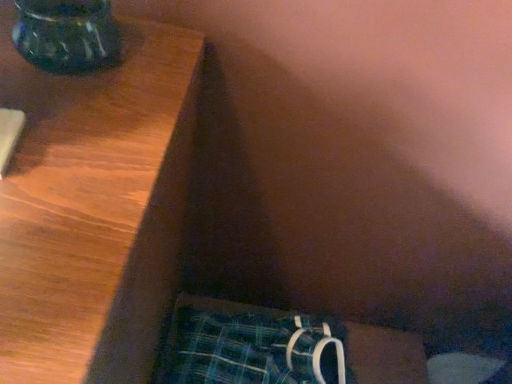
Based on the photo, what is the approximate height of plaid fabric underwear at lower right?

The height of plaid fabric underwear at lower right is 4.84 inches.

Locate an element on the screen. plaid fabric underwear at lower right is located at coordinates coord(251,349).

What do you see at coordinates (251, 349) in the screenshot? I see `plaid fabric underwear at lower right` at bounding box center [251, 349].

Locate an element on the screen. The height and width of the screenshot is (384, 512). translucent glass vase at upper left is located at coordinates (66, 34).

Measure the distance between point (x=82, y=70) and camera.

The depth of point (x=82, y=70) is 14.80 inches.

What do you see at coordinates (66, 34) in the screenshot?
I see `translucent glass vase at upper left` at bounding box center [66, 34].

Locate an element on the screen. Image resolution: width=512 pixels, height=384 pixels. plaid fabric underwear at lower right is located at coordinates (251, 349).

Consider the image. Between translucent glass vase at upper left and plaid fabric underwear at lower right, which one appears on the right side from the viewer's perspective?

Positioned to the right is plaid fabric underwear at lower right.

Which object is further away from the camera, translucent glass vase at upper left or plaid fabric underwear at lower right?

plaid fabric underwear at lower right is behind.

Considering the positions of points (119, 50) and (337, 338), is point (119, 50) farther from camera compared to point (337, 338)?

No.

From the image's perspective, between translucent glass vase at upper left and plaid fabric underwear at lower right, who is located below?

plaid fabric underwear at lower right, from the image's perspective.

From a real-world perspective, is translucent glass vase at upper left physically located above or below plaid fabric underwear at lower right?

translucent glass vase at upper left is above plaid fabric underwear at lower right.

Does translucent glass vase at upper left have a greater width compared to plaid fabric underwear at lower right?

In fact, translucent glass vase at upper left might be narrower than plaid fabric underwear at lower right.

Considering the sizes of objects translucent glass vase at upper left and plaid fabric underwear at lower right in the image provided, who is taller, translucent glass vase at upper left or plaid fabric underwear at lower right?

plaid fabric underwear at lower right.

Considering the relative sizes of translucent glass vase at upper left and plaid fabric underwear at lower right in the image provided, is translucent glass vase at upper left smaller than plaid fabric underwear at lower right?

Correct, translucent glass vase at upper left occupies less space than plaid fabric underwear at lower right.

Is plaid fabric underwear at lower right located within translucent glass vase at upper left?

No, translucent glass vase at upper left does not contain plaid fabric underwear at lower right.

Is translucent glass vase at upper left next to plaid fabric underwear at lower right?

translucent glass vase at upper left is not next to plaid fabric underwear at lower right, and they're not touching.

Does translucent glass vase at upper left turn towards plaid fabric underwear at lower right?

No, translucent glass vase at upper left is not facing towards plaid fabric underwear at lower right.

Find the location of a particular element. The image size is (512, 384). underclothes behind the translucent glass vase at upper left is located at coordinates (251, 349).

Is plaid fabric underwear at lower right to the left of translucent glass vase at upper left from the viewer's perspective?

No, plaid fabric underwear at lower right is not to the left of translucent glass vase at upper left.

Which is in front, plaid fabric underwear at lower right or translucent glass vase at upper left?

translucent glass vase at upper left.

Between point (322, 368) and point (42, 10), which one is positioned in front?

The point (42, 10) is in front.

From the image's perspective, which is above, plaid fabric underwear at lower right or translucent glass vase at upper left?

translucent glass vase at upper left, from the image's perspective.

From a real-world perspective, which object rests below the other?

plaid fabric underwear at lower right.

Considering the sizes of objects plaid fabric underwear at lower right and translucent glass vase at upper left in the image provided, who is thinner, plaid fabric underwear at lower right or translucent glass vase at upper left?

translucent glass vase at upper left is thinner.

Considering the sizes of plaid fabric underwear at lower right and translucent glass vase at upper left in the image, is plaid fabric underwear at lower right taller or shorter than translucent glass vase at upper left?

In the image, plaid fabric underwear at lower right appears to be taller than translucent glass vase at upper left.

Which of these two, plaid fabric underwear at lower right or translucent glass vase at upper left, is bigger?

plaid fabric underwear at lower right.

Is plaid fabric underwear at lower right completely or partially outside of translucent glass vase at upper left?

Yes, plaid fabric underwear at lower right is located beyond the bounds of translucent glass vase at upper left.

Is plaid fabric underwear at lower right placed right next to translucent glass vase at upper left?

No, plaid fabric underwear at lower right is not beside translucent glass vase at upper left.

Is plaid fabric underwear at lower right looking in the opposite direction of translucent glass vase at upper left?

No, plaid fabric underwear at lower right's orientation is not away from translucent glass vase at upper left.

How many degrees apart are the facing directions of plaid fabric underwear at lower right and translucent glass vase at upper left?

The facing directions of plaid fabric underwear at lower right and translucent glass vase at upper left are 5.62 degrees apart.

The image size is (512, 384). Find the location of `underclothes below the translucent glass vase at upper left (from the image's perspective)`. underclothes below the translucent glass vase at upper left (from the image's perspective) is located at coordinates (251, 349).

The height and width of the screenshot is (384, 512). Identify the location of underclothes on the right of translucent glass vase at upper left. (251, 349).

What are the coordinates of `vase in front of the plaid fabric underwear at lower right` in the screenshot? It's located at (66, 34).